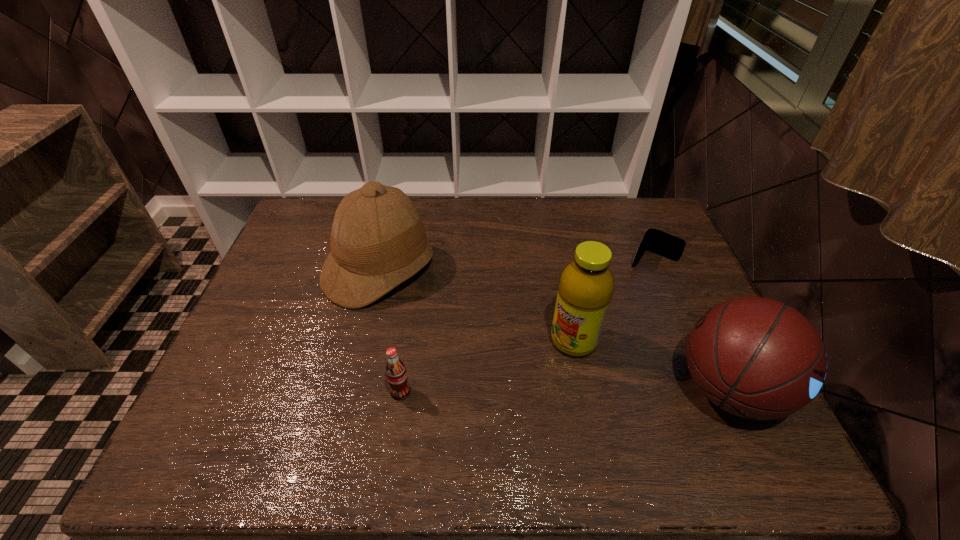
Identify the location of soda. The width and height of the screenshot is (960, 540). (396, 374).

Find the location of a particular element. basketball is located at coordinates (757, 358).

Find the location of `the shortest object`. the shortest object is located at coordinates (656, 241).

Find the location of a particular element. This screenshot has width=960, height=540. fruit juice is located at coordinates (586, 285).

This screenshot has width=960, height=540. Identify the location of hat. (378, 240).

Identify the location of vacant area located on the right of the second shortest object. Image resolution: width=960 pixels, height=540 pixels. (516, 392).

The width and height of the screenshot is (960, 540). Find the location of `vacant space located 0.170m on the back of the basketball`. vacant space located 0.170m on the back of the basketball is located at coordinates (x=687, y=297).

You are a GUI agent. You are given a task and a screenshot of the screen. Output one action in this format:
    pyautogui.click(x=<x>, y=<y>)
    Task: Click on the vacant space located on the outer surface of the shortest object
    The height and width of the screenshot is (540, 960).
    Given the screenshot: What is the action you would take?
    pyautogui.click(x=607, y=329)

This screenshot has height=540, width=960. In order to click on free space located 0.290m on the outer surface of the shortest object in this screenshot , I will do `click(607, 329)`.

Where is `vacant area situated on the outer surface of the shortest object`? vacant area situated on the outer surface of the shortest object is located at coordinates (595, 350).